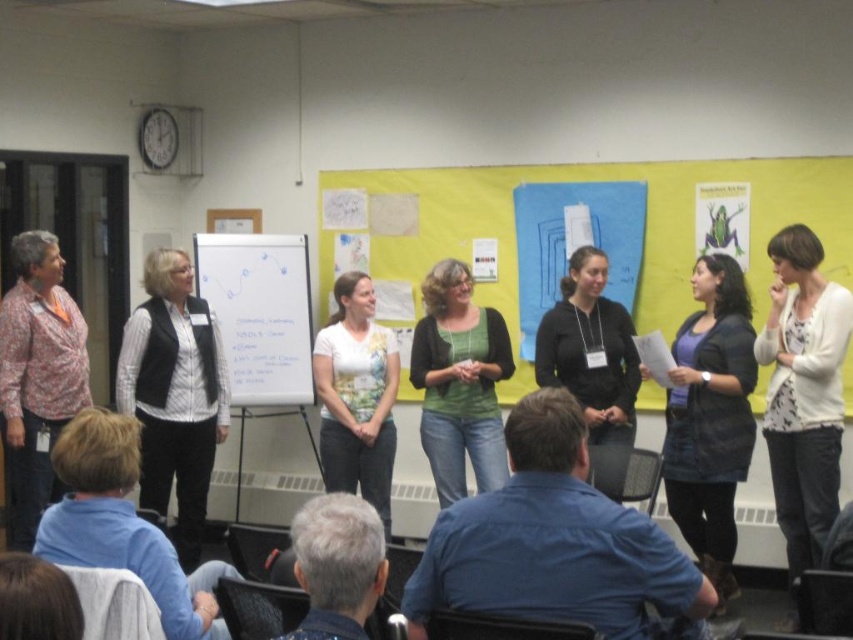
You are organizing a clothing display and need to place the white textured cardigan at center and the black matte vest at center side by side on a narrow shelf. Which item should you place first to ensure both fit on the shelf?

The white textured cardigan at center has a lesser width compared to the black matte vest at center, so you should place the black matte vest at center first to accommodate its larger size, then the white textured cardigan at center next to it.

You are standing in the room and want to reach both the point at coordinates point (724, 355) and point (476, 369). Which point should you reach first if you want to minimize the distance walked?

Point (724, 355) is closer to the camera than point (476, 369), so you should reach point (724, 355) first to minimize the distance walked.